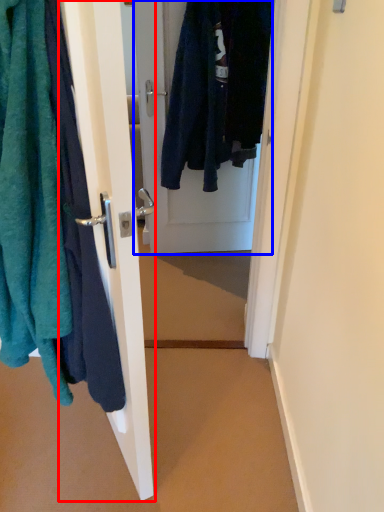
Question: Among these objects, which one is nearest to the camera, door (highlighted by a red box) or door (highlighted by a blue box)?

Choices:
 (A) door
 (B) door

Answer: (A)